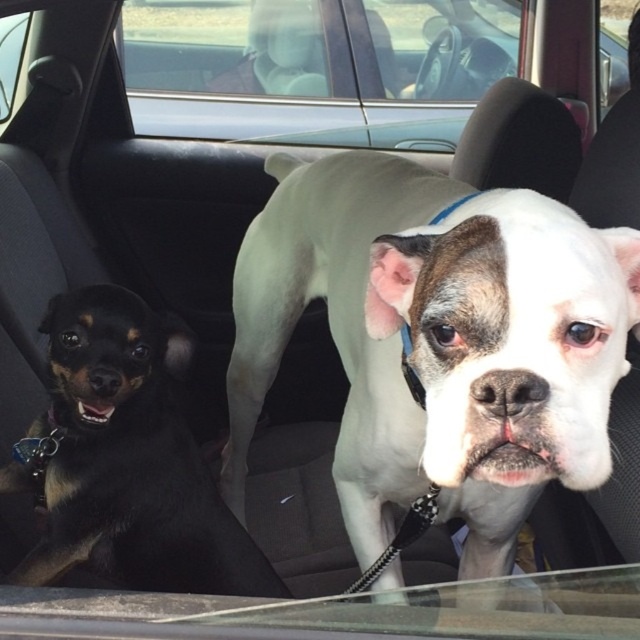
You are a passenger in the car and want to know where the white smooth dog at center is located. Please provide its coordinates based on the car interior.

The white smooth dog at center is located at coordinates point [436,340].